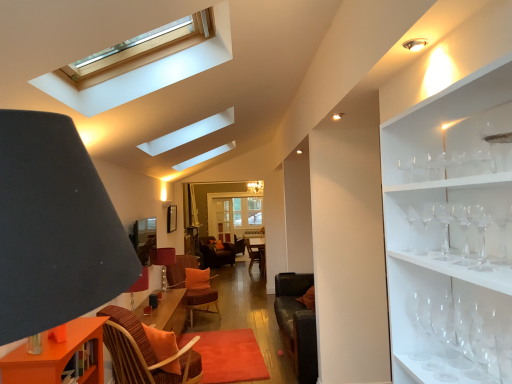
Question: From the image's perspective, relative to transparent glass wine glass at right, which ranks as the 2th wine glass in back-to-front order, is orange fabric pillow at center above or below?

Choices:
 (A) below
 (B) above

Answer: (A)

Question: From a real-world perspective, is orange fabric pillow at center physically located above or below transparent glass wine glass at right, which is the seventh wine glass in front-to-back order?

Choices:
 (A) below
 (B) above

Answer: (A)

Question: Which object is positioned closest to the clear glass wine glass at right, which appears as the fifth wine glass when viewed from the back?

Choices:
 (A) transparent glass wine glass at right, arranged as the eighth wine glass when viewed from the front
 (B) orange fabric swivel chair at center
 (C) matte brown table lamp at center
 (D) orange fabric pillow at center
 (E) transparent glass wine glass at right, the 6th wine glass when ordered from back to front

Answer: (A)

Question: Which of these objects is positioned farthest from the transparent glass wine glass at right, arranged as the eighth wine glass when viewed from the front?

Choices:
 (A) matte brown table lamp at center
 (B) orange wood table at lower left
 (C) transparent glass wine glass at right, the fifth wine glass from the front
 (D) clear glass wine glass at right, placed as the sixth wine glass when sorted from front to back
 (E) clear glass wine glass at right, arranged as the 1th wine glass when viewed from the front

Answer: (A)